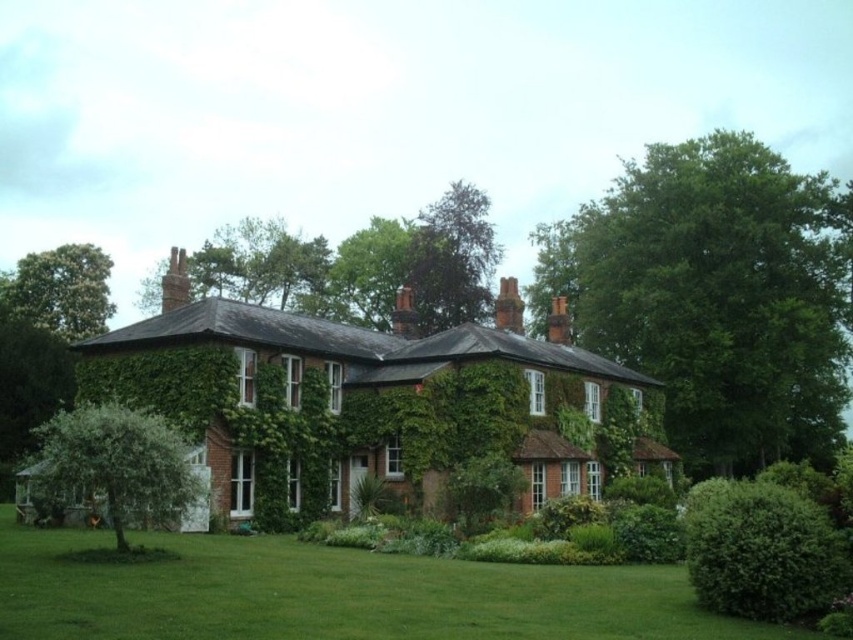
You are standing on the lawn in front of the house. You want to place a picnic blanket between the green leafy tree at lower left and the brown brick chimney at center. Which object should you position the blanket closer to to ensure it fits within the space between them?

The green leafy tree at lower left is wider than the brown brick chimney at center. To ensure the picnic blanket fits within the space between them, position it closer to the brown brick chimney at center since the tree takes up more width.

You are standing on the lawn in front of the house. You want to find the tallest object between the green leafy tree at upper center and the brown brick chimney at center. Which one should you look up to?

The green leafy tree at upper center is much taller than the brown brick chimney at center, so you should look up at the green leafy tree at upper center.